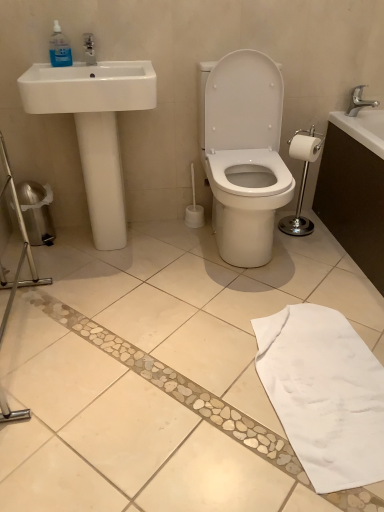
What is the approximate height of silver metallic toilet paper holder at right?

silver metallic toilet paper holder at right is 22.98 inches in height.

Identify the location of white glossy toilet at center. This screenshot has height=512, width=384. (245, 155).

This screenshot has height=512, width=384. Identify the location of silver metallic faucet at upper right. (359, 101).

Consider the image. Measure the distance between silver metallic faucet at upper right and camera.

silver metallic faucet at upper right is 7.12 feet from camera.

The width and height of the screenshot is (384, 512). I want to click on white matte toilet paper at right, so click(305, 148).

Are white glossy sink at left and white glossy toilet at center making contact?

No, white glossy sink at left is not with white glossy toilet at center.

What's the angular difference between white glossy sink at left and white glossy toilet at center's facing directions?

0.0297 degrees separate the facing orientations of white glossy sink at left and white glossy toilet at center.

Do you think white glossy sink at left is within white glossy toilet at center, or outside of it?

white glossy sink at left is located beyond the bounds of white glossy toilet at center.

What are the coordinates of `toilet located underneath the white glossy sink at left (from a real-world perspective)` in the screenshot? It's located at (245, 155).

In the scene shown: How far apart are white glossy toilet at center and silver metallic faucet at upper right?

A distance of 27.69 inches exists between white glossy toilet at center and silver metallic faucet at upper right.

Can you confirm if white glossy toilet at center is positioned to the right of silver metallic faucet at upper right?

No.

Who is shorter, white glossy toilet at center or silver metallic faucet at upper right?

silver metallic faucet at upper right is shorter.

Considering the positions of point (251, 52) and point (354, 96), is point (251, 52) closer or farther from the camera than point (354, 96)?

Point (251, 52) is closer to the camera than point (354, 96).

How much distance is there between transparent plastic bottle at upper left and silver metallic faucet at upper right?

transparent plastic bottle at upper left and silver metallic faucet at upper right are 4.73 feet apart.

From a real-world perspective, is transparent plastic bottle at upper left physically above silver metallic faucet at upper right?

Correct, in the physical world, transparent plastic bottle at upper left is higher than silver metallic faucet at upper right.

Which of these two, transparent plastic bottle at upper left or silver metallic faucet at upper right, is smaller?

Smaller between the two is transparent plastic bottle at upper left.

Consider the image. Considering the relative positions of silver metallic faucet at upper right and white glossy toilet at center in the image provided, is silver metallic faucet at upper right to the right of white glossy toilet at center from the viewer's perspective?

Yes.

From the image's perspective, is silver metallic faucet at upper right located above white glossy toilet at center?

Yes, from the image's perspective, silver metallic faucet at upper right is over white glossy toilet at center.

Between silver metallic faucet at upper right and white glossy toilet at center, which one has smaller size?

silver metallic faucet at upper right.

Which is in front, silver metallic faucet at upper right or white glossy toilet at center?

white glossy toilet at center is closer to the camera.

From the image's perspective, which object appears higher, white matte toilet paper at right or transparent plastic bottle at upper left?

transparent plastic bottle at upper left, from the image's perspective.

Is white matte toilet paper at right turned away from transparent plastic bottle at upper left?

white matte toilet paper at right is not turned away from transparent plastic bottle at upper left.

Is white matte toilet paper at right spatially inside transparent plastic bottle at upper left, or outside of it?

white matte toilet paper at right lies outside transparent plastic bottle at upper left.

Does point (326, 331) appear closer or farther from the camera than point (317, 138)?

Point (326, 331).

What are the coordinates of `bath towel beneath the white matte toilet paper at right (from a real-world perspective)` in the screenshot? It's located at (324, 394).

Is white cotton bath towel at lower right to the right of white matte toilet paper at right from the viewer's perspective?

No.

Is white cotton bath towel at lower right aimed at white matte toilet paper at right?

No, white cotton bath towel at lower right is not aimed at white matte toilet paper at right.

Is silver metallic faucet at upper right surrounding transparent plastic bottle at upper left?

That's incorrect, transparent plastic bottle at upper left is not inside silver metallic faucet at upper right.

In terms of size, does silver metallic faucet at upper right appear bigger or smaller than transparent plastic bottle at upper left?

silver metallic faucet at upper right is bigger than transparent plastic bottle at upper left.

Is point (361, 102) closer or farther from the camera than point (67, 50)?

Clearly, point (361, 102) is more distant from the camera than point (67, 50).

From the image's perspective, is silver metallic faucet at upper right located above or below transparent plastic bottle at upper left?

Clearly, from the image's perspective, silver metallic faucet at upper right is below transparent plastic bottle at upper left.

This screenshot has height=512, width=384. What are the coordinates of `sink located above the white glossy toilet at center (from the image's perspective)` in the screenshot? It's located at (95, 126).

Locate an element on the screen. toilet that is below the silver metallic faucet at upper right (from the image's perspective) is located at coordinates (245, 155).

From the picture: Considering their positions, is white matte toilet paper at right positioned closer to silver metallic toilet paper holder at right than white glossy sink at left?

white matte toilet paper at right.

Looking at the image, which one is located further to white glossy sink at left, silver metallic faucet at upper right or white cotton bath towel at lower right?

Among the two, silver metallic faucet at upper right is located further to white glossy sink at left.

Considering their positions, is transparent plastic bottle at upper left positioned closer to white glossy toilet at center than white matte toilet paper at right?

white matte toilet paper at right is closer to white glossy toilet at center.

Based on their spatial positions, is silver metallic toilet paper holder at right or white glossy sink at left closer to white glossy toilet at center?

silver metallic toilet paper holder at right is closer to white glossy toilet at center.

Looking at the image, which one is located closer to white matte toilet paper at right, silver metallic toilet paper holder at right or white cotton bath towel at lower right?

silver metallic toilet paper holder at right.

Looking at this image, considering their positions, is white cotton bath towel at lower right positioned closer to silver metallic toilet paper holder at right than white matte toilet paper at right?

The object closer to silver metallic toilet paper holder at right is white matte toilet paper at right.

Which object lies further to the anchor point white glossy toilet at center, silver metallic toilet paper holder at right or silver metallic faucet at upper right?

Among the two, silver metallic faucet at upper right is located further to white glossy toilet at center.

Considering their positions, is white glossy sink at left positioned closer to silver metallic faucet at upper right than white glossy toilet at center?

Based on the image, white glossy toilet at center appears to be nearer to silver metallic faucet at upper right.

You are a GUI agent. You are given a task and a screenshot of the screen. Output one action in this format:
    pyautogui.click(x=<x>, y=<y>)
    Task: Click on the toilet between silver metallic faucet at upper right and white cotton bath towel at lower right in the up-down direction
    This screenshot has width=384, height=512.
    Given the screenshot: What is the action you would take?
    pyautogui.click(x=245, y=155)

Where is `tap between white glossy toilet at center and silver metallic toilet paper holder at right`? This screenshot has width=384, height=512. tap between white glossy toilet at center and silver metallic toilet paper holder at right is located at coordinates tap(359, 101).

The height and width of the screenshot is (512, 384). I want to click on toilet between transparent plastic bottle at upper left and silver metallic faucet at upper right from left to right, so click(x=245, y=155).

Where is `toilet paper between silver metallic faucet at upper right and white cotton bath towel at lower right in the up-down direction`? The height and width of the screenshot is (512, 384). toilet paper between silver metallic faucet at upper right and white cotton bath towel at lower right in the up-down direction is located at coordinates (305, 148).